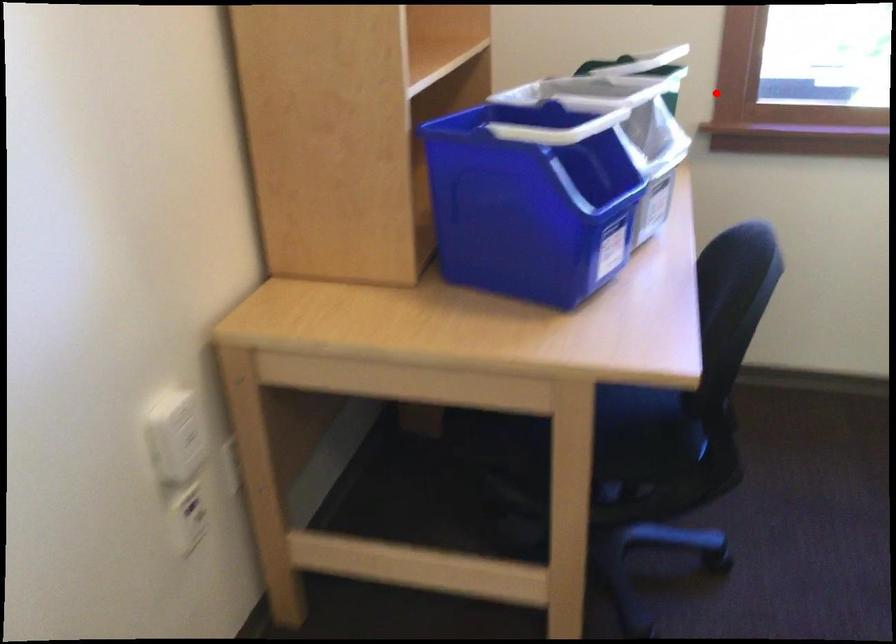
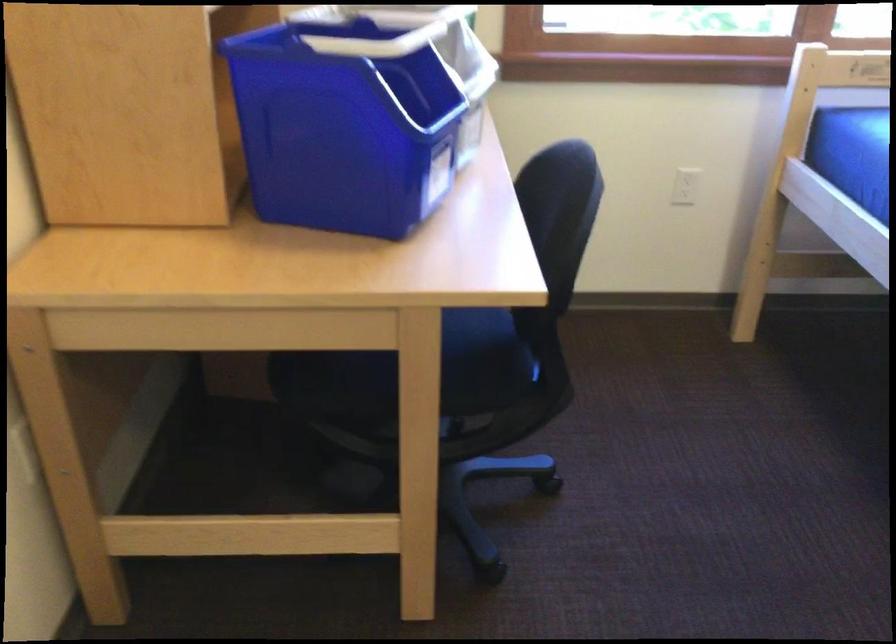
Find the pixel in the second image that matches the highlighted location in the first image.

(506, 26)